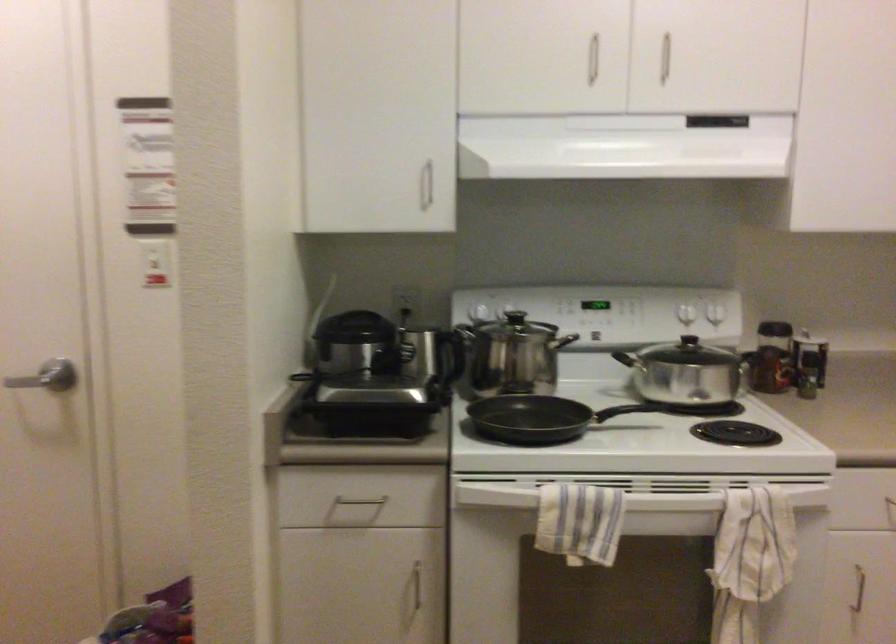
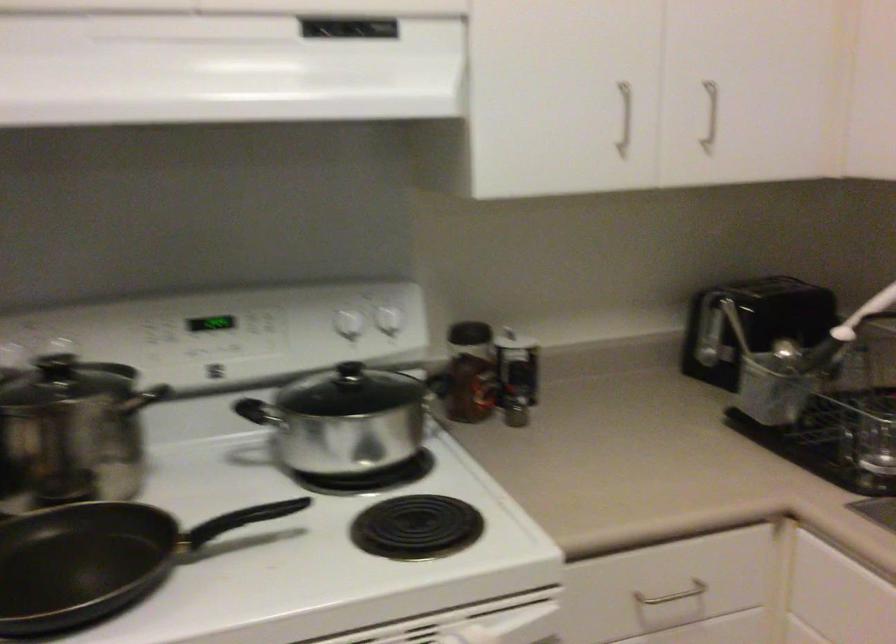
Question: Based on the continuous images, in which direction is the camera rotating? Reply with the corresponding letter.

Choices:
 (A) Left
 (B) Right
 (C) Up
 (D) Down

Answer: (B)